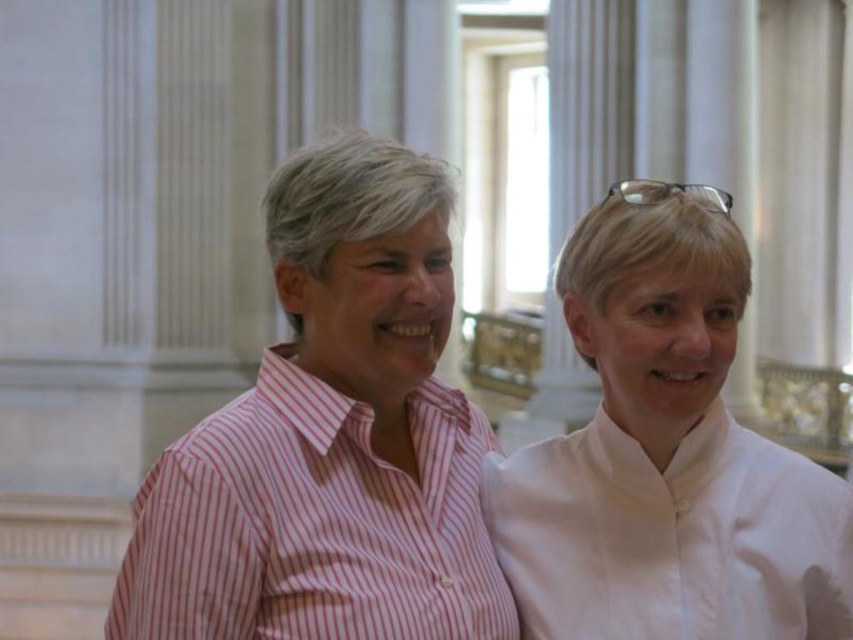
Question: Based on their relative distances, which object is nearer to the pink striped shirt at left?

Choices:
 (A) pink striped shirt at center
 (B) white smooth shirt at right

Answer: (A)

Question: Which of these objects is positioned closest to the white smooth shirt at right?

Choices:
 (A) pink striped shirt at center
 (B) pink striped shirt at left

Answer: (A)

Question: Does white smooth shirt at right lie in front of pink striped shirt at left?

Choices:
 (A) no
 (B) yes

Answer: (A)

Question: Estimate the real-world distances between objects in this image. Which object is farther from the white smooth shirt at right?

Choices:
 (A) pink striped shirt at center
 (B) pink striped shirt at left

Answer: (B)

Question: Is white smooth shirt at right closer to the viewer compared to pink striped shirt at left?

Choices:
 (A) yes
 (B) no

Answer: (B)

Question: Does white smooth shirt at right have a smaller size compared to pink striped shirt at left?

Choices:
 (A) no
 (B) yes

Answer: (B)